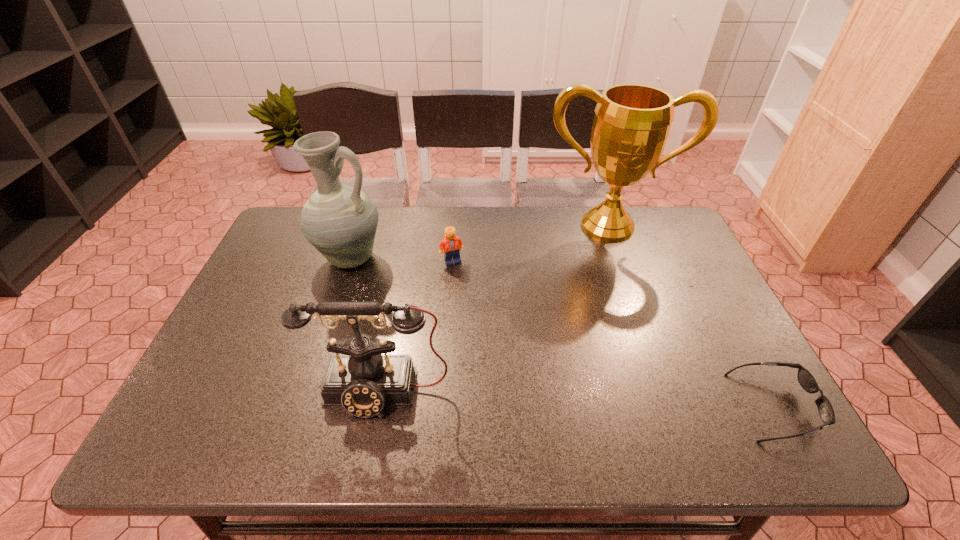
Locate an element on the screen. This screenshot has height=540, width=960. object that can be found as the closest to the third tallest object is located at coordinates (340, 221).

At what (x,y) coordinates should I click in order to perform the action: click on blank space that satisfies the following two spatial constraints: 1. on the front side of the Lego; 2. on the left side of the pitcher. Please return your answer as a coordinate pair (x, y). Looking at the image, I should click on (348, 261).

Locate an element on the screen. free spot that satisfies the following two spatial constraints: 1. on the front side of the award; 2. on the front-facing side of the shortest object is located at coordinates (671, 406).

Locate an element on the screen. vacant point that satisfies the following two spatial constraints: 1. on the front side of the second shortest object; 2. on the front-facing side of the shortest object is located at coordinates (442, 406).

Locate an element on the screen. This screenshot has height=540, width=960. free location that satisfies the following two spatial constraints: 1. on the front side of the pitcher; 2. on the right side of the Lego is located at coordinates (348, 261).

Where is `free space that satisfies the following two spatial constraints: 1. on the dial of the shortest object; 2. on the front-facing side of the telephone`? The width and height of the screenshot is (960, 540). free space that satisfies the following two spatial constraints: 1. on the dial of the shortest object; 2. on the front-facing side of the telephone is located at coordinates tap(377, 406).

The width and height of the screenshot is (960, 540). I want to click on free space that satisfies the following two spatial constraints: 1. on the back side of the award; 2. on the right side of the second tallest object, so click(361, 226).

At what (x,y) coordinates should I click in order to perform the action: click on free space that satisfies the following two spatial constraints: 1. on the dial of the telephone; 2. on the front-facing side of the sunglasses. Please return your answer as a coordinate pair (x, y). This screenshot has height=540, width=960. Looking at the image, I should click on (377, 406).